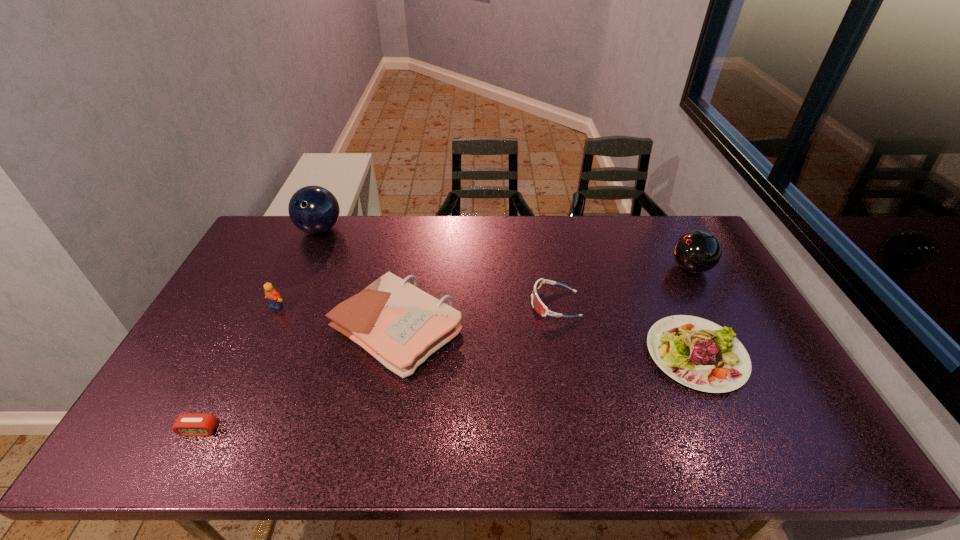
This screenshot has width=960, height=540. In the image, there is a desktop. Find the location of `free space at the far edge`. free space at the far edge is located at coordinates (548, 225).

Find the location of a particular element. This screenshot has width=960, height=540. vacant area at the near edge of the desktop is located at coordinates (498, 434).

This screenshot has height=540, width=960. In order to click on free spot at the left edge of the desktop in this screenshot , I will do `click(204, 355)`.

Where is `free space at the far left corner of the desktop`? This screenshot has height=540, width=960. free space at the far left corner of the desktop is located at coordinates (264, 234).

What are the coordinates of `free space that is in between the tallest object and the nearer bowling ball` in the screenshot? It's located at (505, 249).

Find the location of a particular element. Image resolution: width=960 pixels, height=540 pixels. free point between the sixth nearest object and the salad plate is located at coordinates (x=693, y=312).

In order to click on free space between the salad plate and the left bowling ball in this screenshot , I will do `click(508, 292)`.

Find the location of a particular element. The image size is (960, 540). vacant area that lies between the salad plate and the nearer bowling ball is located at coordinates (693, 312).

Where is `vacant point located between the phonebook and the nearest object`? The width and height of the screenshot is (960, 540). vacant point located between the phonebook and the nearest object is located at coordinates (298, 380).

Where is `unoccupied area between the goggles and the shortest object`? unoccupied area between the goggles and the shortest object is located at coordinates (377, 367).